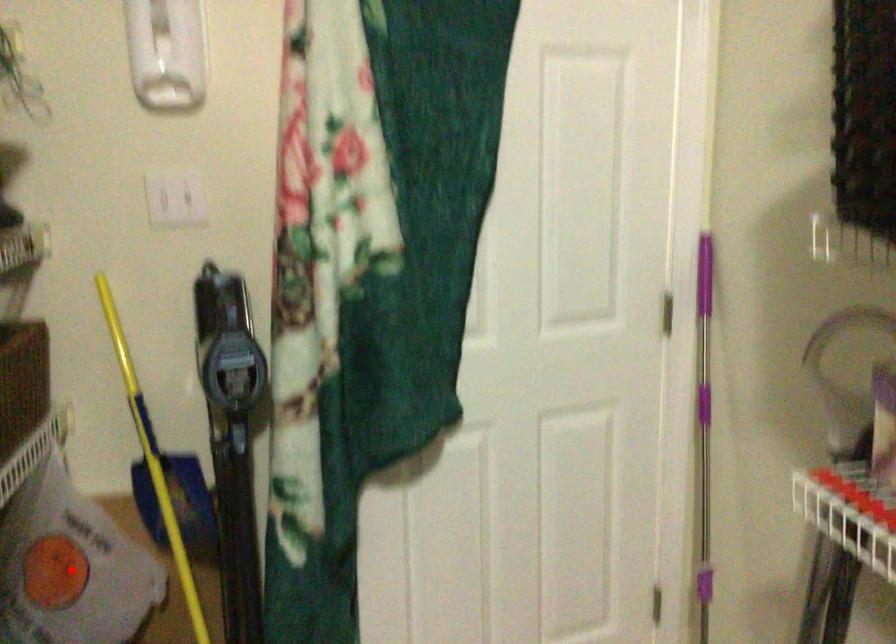
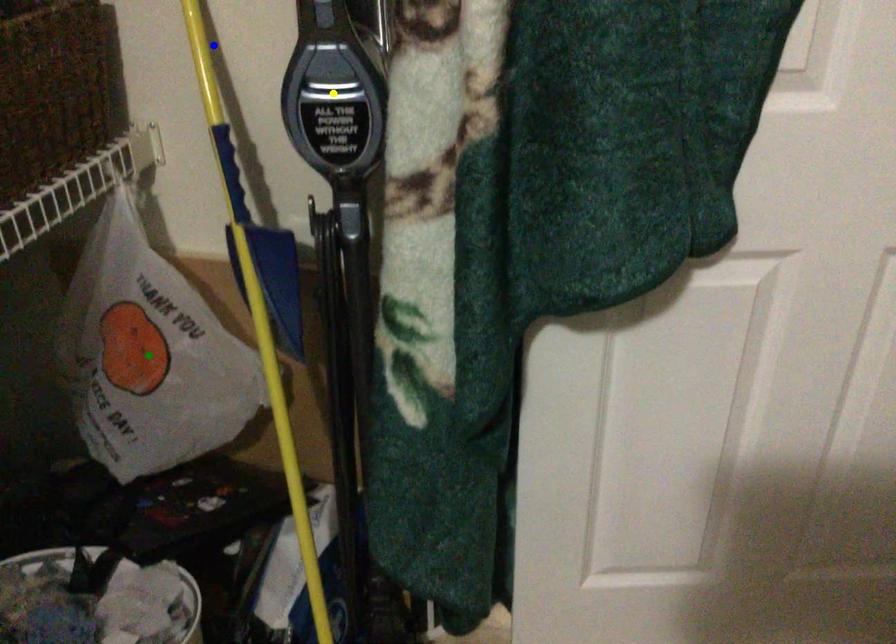
Question: I am providing you with two images of the same scene from different viewpoints. A red point is marked on the first image. You are given multiple points on the second image. Which point in image 2 represents the same 3d spot as the red point in image 1?

Choices:
 (A) yellow point
 (B) blue point
 (C) green point

Answer: (C)